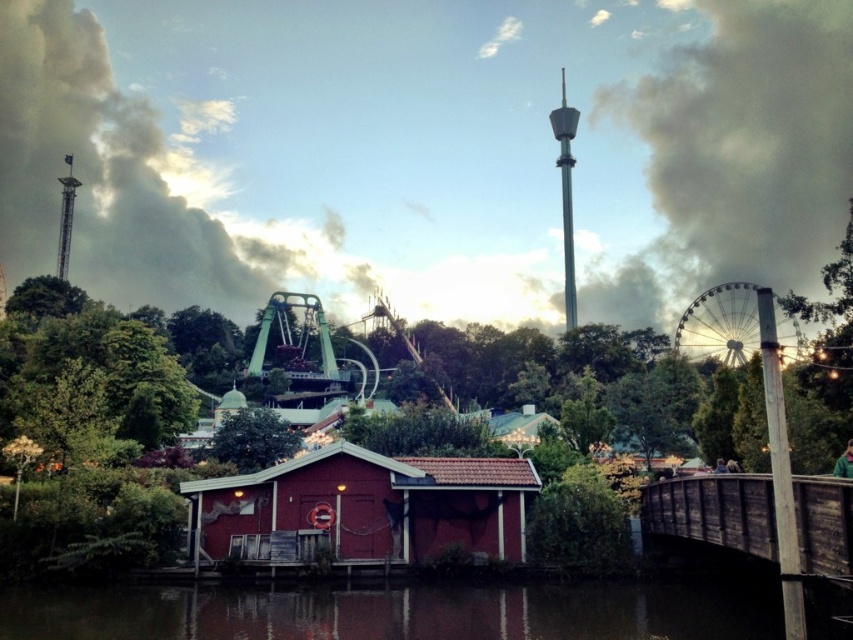
Question: Can you confirm if transparent water at lower center is smaller than wooden bridge at lower right?

Choices:
 (A) yes
 (B) no

Answer: (B)

Question: Which point is closer to the camera?

Choices:
 (A) (735, 486)
 (B) (590, 586)
 (C) (61, 412)

Answer: (A)

Question: Which point is farther to the camera?

Choices:
 (A) (35, 481)
 (B) (840, 531)
 (C) (553, 612)

Answer: (A)

Question: Is red matte building at center behind wooden bridge at lower right?

Choices:
 (A) yes
 (B) no

Answer: (A)

Question: Which point is farther to the camera?

Choices:
 (A) red matte building at center
 (B) transparent water at lower center
 (C) wooden bridge at lower right

Answer: (B)

Question: Does red matte building at center come behind transparent water at lower center?

Choices:
 (A) no
 (B) yes

Answer: (A)